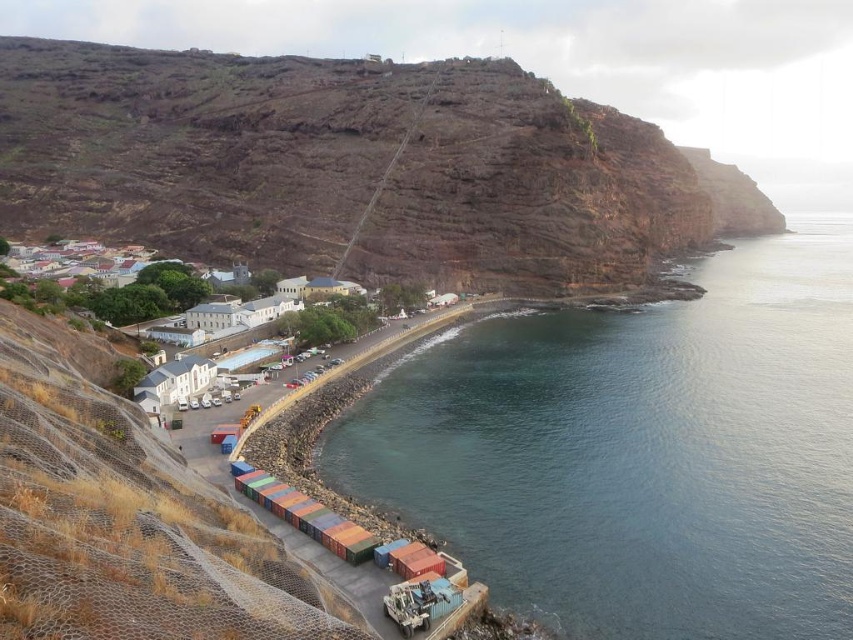
Looking at this image, you are standing at the base of the brown rocky cliff at upper left and want to reach the blue water at lower right. Which direction should you move to get there?

The blue water at lower right is in front of the brown rocky cliff at upper left, so you should move towards the lower right direction to reach it.

You are a photographer planning to capture the entire view of the brown rocky cliff at upper left and the blue water at lower right in one shot. Based on their widths, which object should you prioritize framing first to ensure both fit in the photo?

The blue water at lower right has a lesser width compared to the brown rocky cliff at upper left. Therefore, you should prioritize framing the brown rocky cliff at upper left first since it occupies more space, ensuring there is enough room for the narrower blue water at lower right.